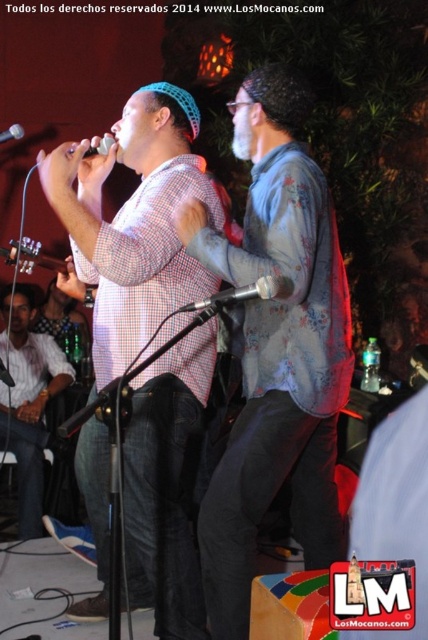
Question: Can you confirm if matte brown guitar at left is smaller than black metallic microphone at center?

Choices:
 (A) no
 (B) yes

Answer: (A)

Question: Can you confirm if white shirt at left is smaller than matte black microphone at upper left?

Choices:
 (A) yes
 (B) no

Answer: (B)

Question: Estimate the real-world distances between objects in this image. Which object is farther from the white shirt at left?

Choices:
 (A) matte black microphone at upper center
 (B) matte black microphone at upper left
 (C) matte brown guitar at left
 (D) black metallic microphone at center

Answer: (D)

Question: Which point is farther from the camera taking this photo?

Choices:
 (A) (14, 436)
 (B) (100, 154)

Answer: (A)

Question: Which point is closer to the camera taking this photo?

Choices:
 (A) (143, 288)
 (B) (89, 145)
 (C) (39, 493)
 (D) (291, 86)

Answer: (D)

Question: Is floral-patterned shirt at center thinner than matte brown guitar at left?

Choices:
 (A) yes
 (B) no

Answer: (A)